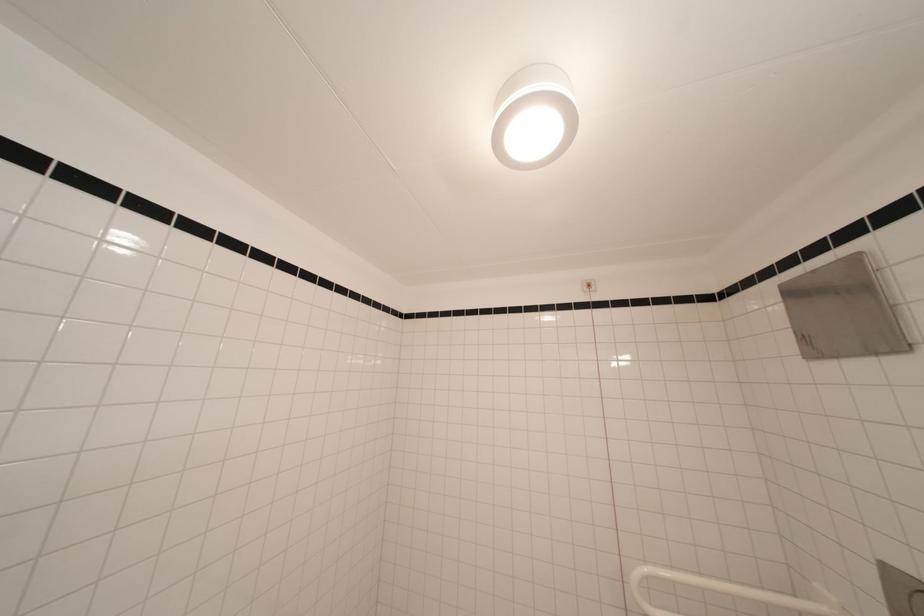
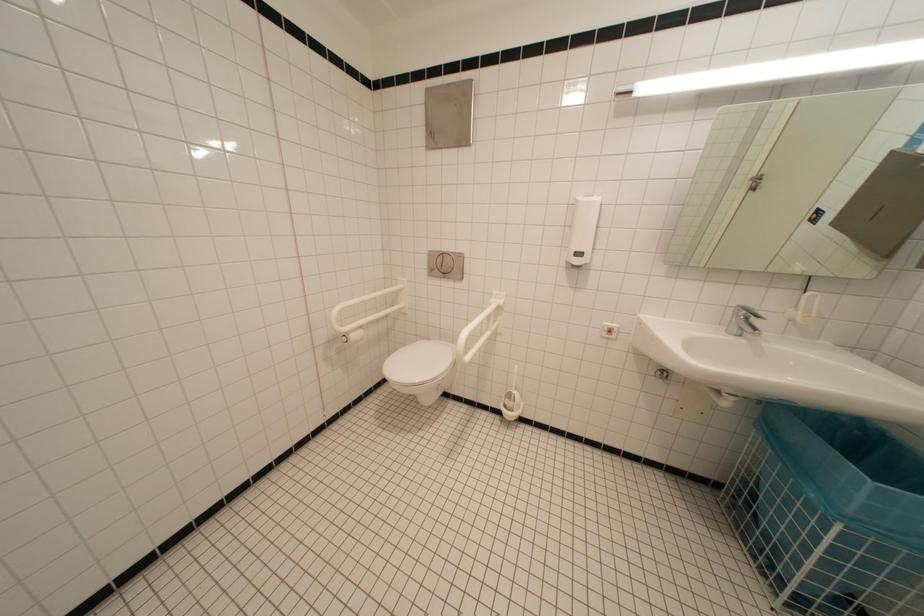
Based on the continuous images, in which direction is the camera rotating?

The camera's rotation is toward right-down.